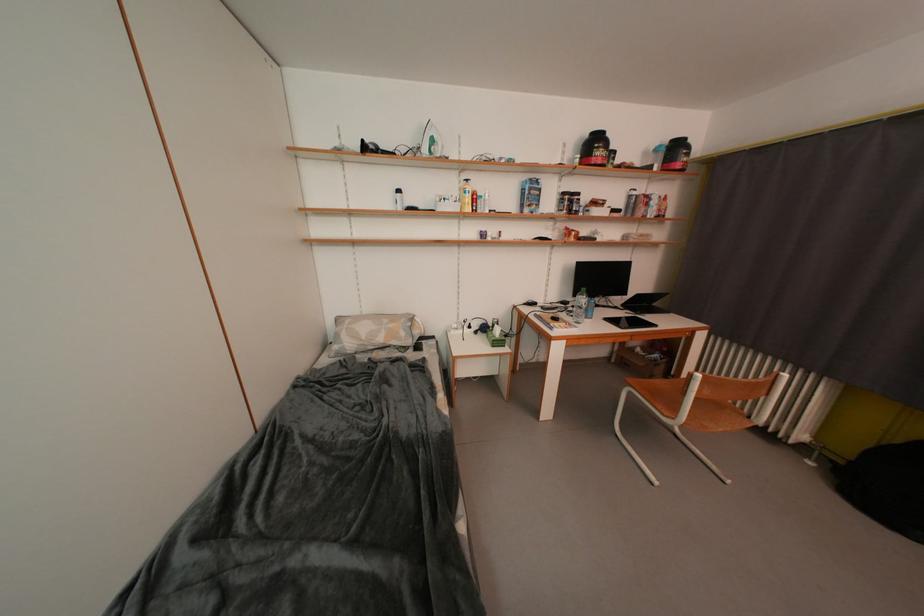
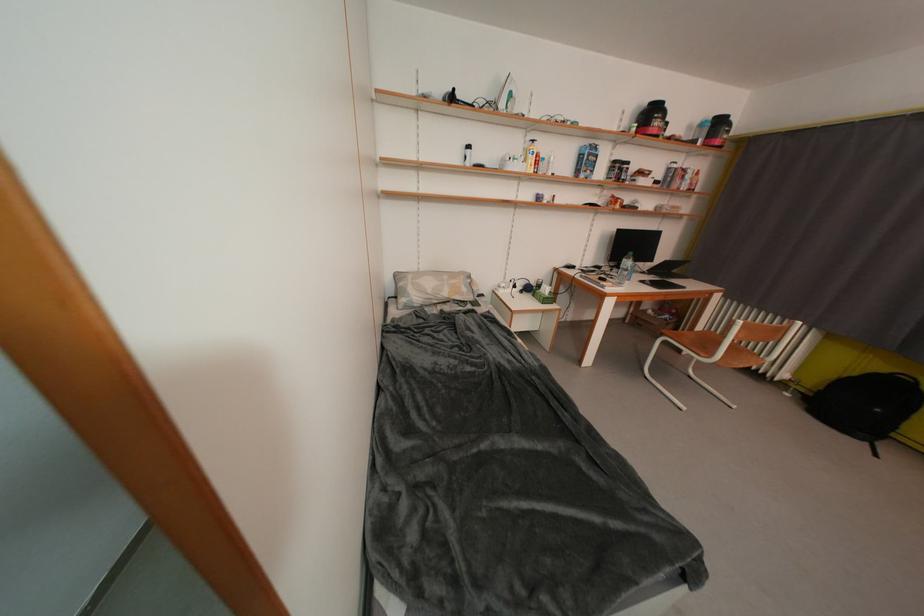
Find the pixel in the second image that matches (x=586, y=300) in the first image.

(631, 262)